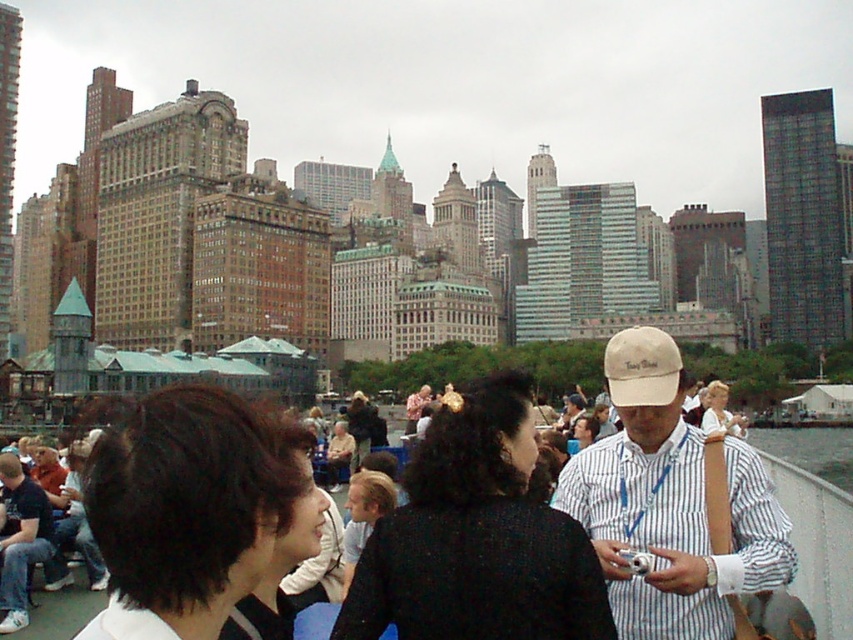
Question: Is beige fabric baseball cap at center above clear glass water at lower right?

Choices:
 (A) no
 (B) yes

Answer: (B)

Question: Is beige fabric baseball cap at center-right in front of beige fabric baseball cap at center?

Choices:
 (A) yes
 (B) no

Answer: (A)

Question: Which object is the farthest from the clear glass water at lower right?

Choices:
 (A) beige fabric baseball cap at center-right
 (B) beige fabric baseball cap at center

Answer: (A)

Question: Which of the following is the farthest from the observer?

Choices:
 (A) (660, 394)
 (B) (787, 454)

Answer: (B)

Question: Is beige fabric baseball cap at center-right thinner than clear glass water at lower right?

Choices:
 (A) yes
 (B) no

Answer: (A)

Question: Which is nearer to the beige fabric baseball cap at center?

Choices:
 (A) beige fabric baseball cap at center-right
 (B) clear glass water at lower right

Answer: (A)